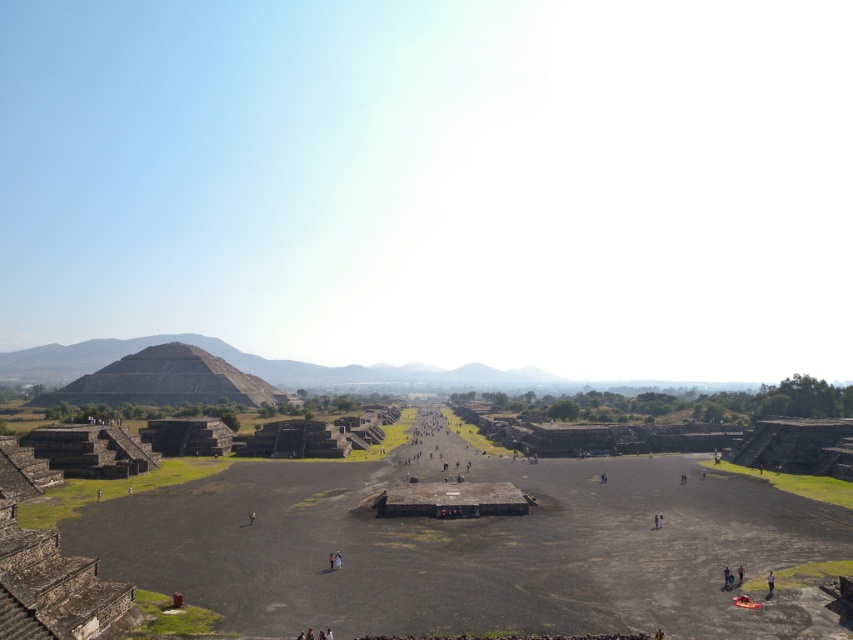
Question: Is gray stone pyramid at center-left bigger than blurred fabric person at lower right?

Choices:
 (A) yes
 (B) no

Answer: (A)

Question: Which of the following is the closest to the observer?

Choices:
 (A) (769, 588)
 (B) (186, 394)

Answer: (A)

Question: Is gray stone pyramid at center-left thinner than blurred fabric person at lower right?

Choices:
 (A) yes
 (B) no

Answer: (B)

Question: Is gray stone pyramid at center-left smaller than blurred fabric person at lower right?

Choices:
 (A) no
 (B) yes

Answer: (A)